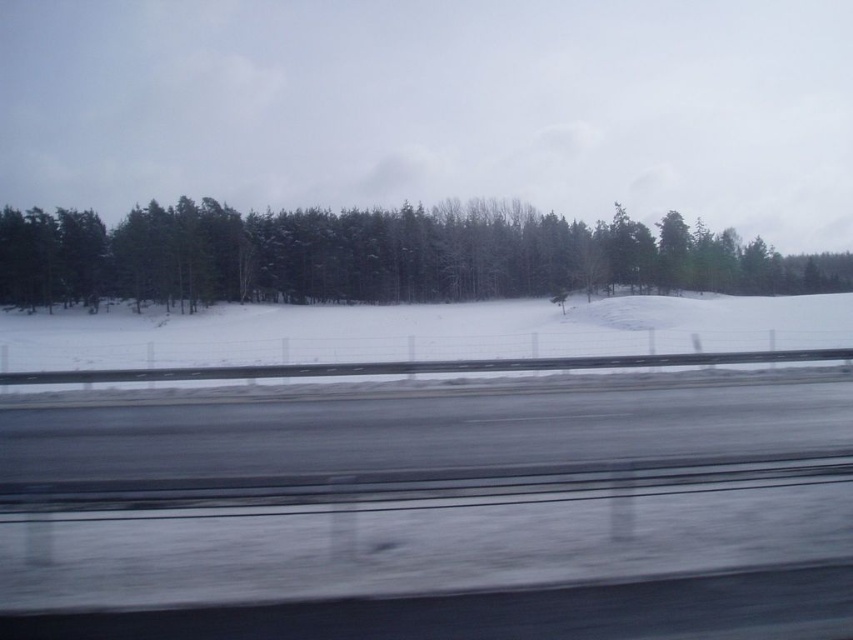
Question: Does green matte tree at left appear on the left side of white powdery snow at center?

Choices:
 (A) no
 (B) yes

Answer: (A)

Question: Does green matte tree at left come in front of white powdery snow at center?

Choices:
 (A) no
 (B) yes

Answer: (A)

Question: Which point is farther to the camera?

Choices:
 (A) white powdery snow at center
 (B) green matte tree at left

Answer: (B)

Question: Can you confirm if green matte tree at left is bigger than white powdery snow at center?

Choices:
 (A) yes
 (B) no

Answer: (A)